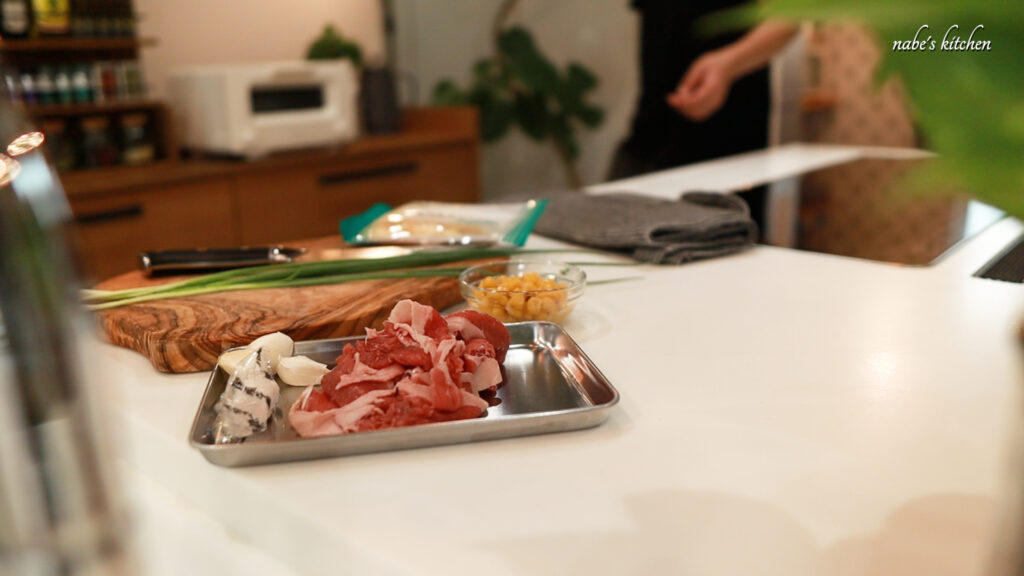
You are a GUI agent. You are given a task and a screenshot of the screen. Output one action in this format:
    pyautogui.click(x=<x>, y=<y>)
    Task: Click on the white countertop
    
    Given the screenshot: What is the action you would take?
    pyautogui.click(x=777, y=478)